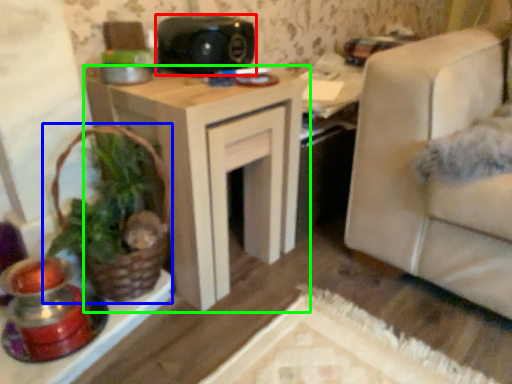
Question: Considering the real-world distances, which object is closest to speaker (highlighted by a red box)? houseplant (highlighted by a blue box) or table (highlighted by a green box).

Choices:
 (A) houseplant
 (B) table

Answer: (B)